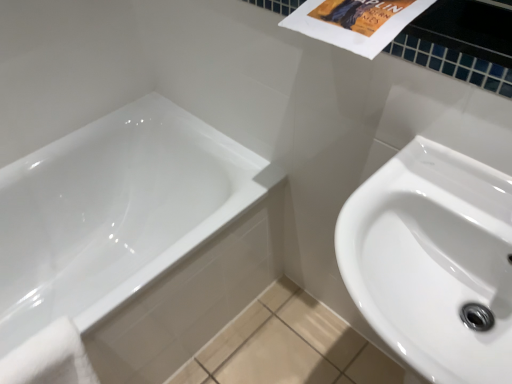
Question: Is white soft towel at lower left bigger or smaller than white glossy sink at right?

Choices:
 (A) small
 (B) big

Answer: (A)

Question: In terms of height, does white soft towel at lower left look taller or shorter compared to white glossy sink at right?

Choices:
 (A) tall
 (B) short

Answer: (B)

Question: Which object is positioned farthest from the white glossy bathtub at lower left?

Choices:
 (A) white soft towel at lower left
 (B) white glossy sink at right

Answer: (B)

Question: Which object is positioned farthest from the white glossy sink at right?

Choices:
 (A) white soft towel at lower left
 (B) white glossy bathtub at lower left

Answer: (A)